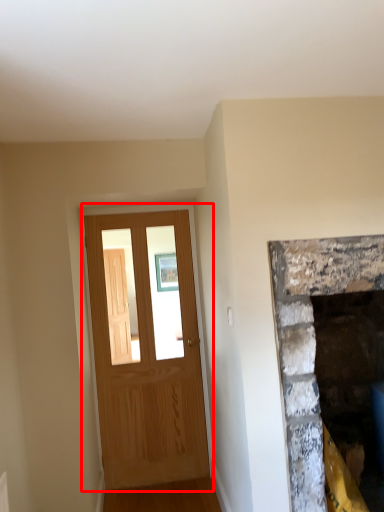
Question: From the image's perspective, considering the relative positions of barn door (annotated by the red box) and fireplace in the image provided, where is barn door (annotated by the red box) located with respect to the staircase?

Choices:
 (A) above
 (B) below

Answer: (A)